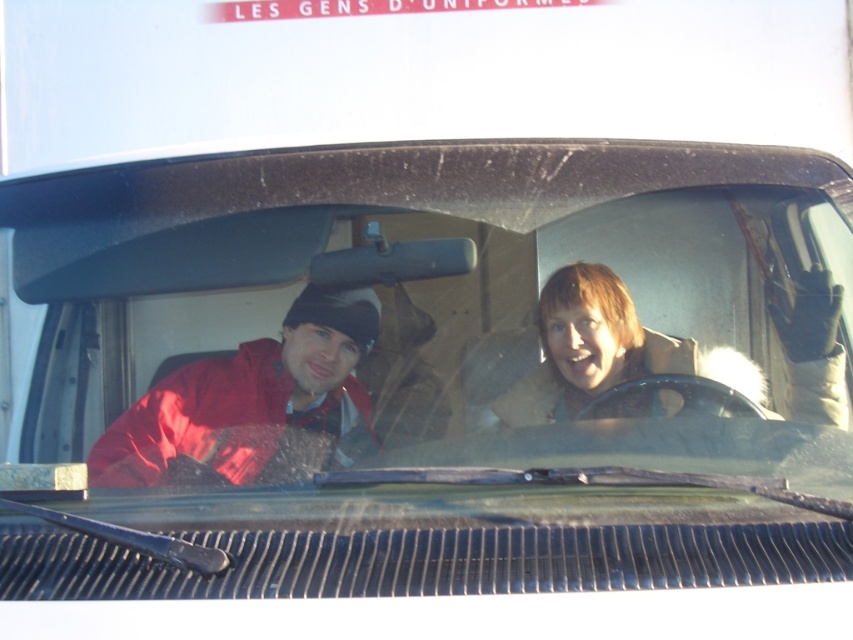
Question: Which object is closer to the camera taking this photo?

Choices:
 (A) matte red jacket at left
 (B) transparent glass windshield at center

Answer: (B)

Question: Which object is closer to the camera taking this photo?

Choices:
 (A) transparent glass windshield at center
 (B) matte red jacket at left

Answer: (A)

Question: Is transparent glass windshield at center further to the viewer compared to matte red jacket at left?

Choices:
 (A) no
 (B) yes

Answer: (A)

Question: Does transparent glass windshield at center lie behind matte red jacket at left?

Choices:
 (A) yes
 (B) no

Answer: (B)

Question: Is transparent glass windshield at center smaller than matte red jacket at left?

Choices:
 (A) yes
 (B) no

Answer: (B)

Question: Which point is farther from the camera taking this photo?

Choices:
 (A) (90, 452)
 (B) (199, 451)

Answer: (A)